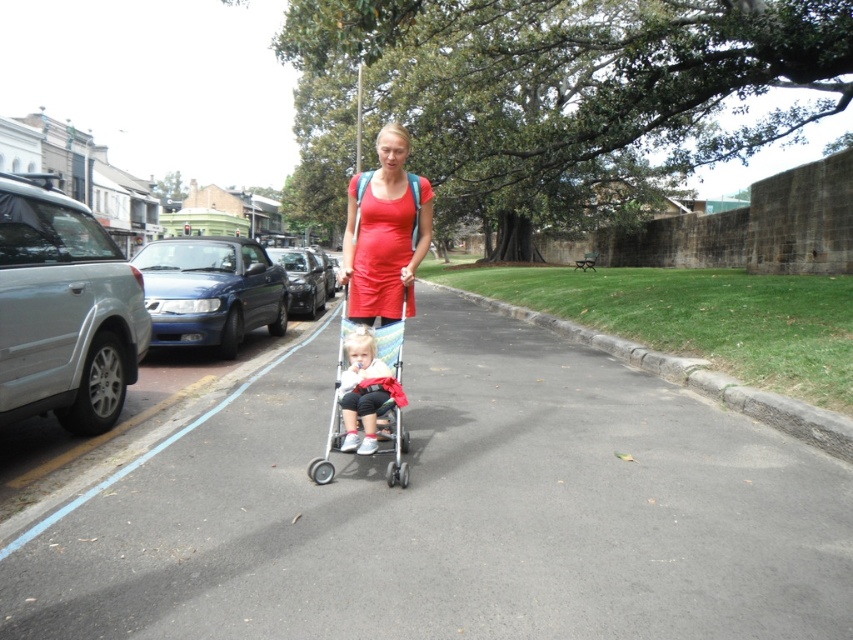
Question: Among these points, which one is nearest to the camera?

Choices:
 (A) (306, 291)
 (B) (177, 243)
 (C) (344, 236)

Answer: (C)

Question: Based on their relative distances, which object is nearer to the silver metallic car at left?

Choices:
 (A) shiny black car at center-left
 (B) matte red dress at center
 (C) matte pink fabric stroller at center

Answer: (C)

Question: Among these points, which one is farthest from the camera?

Choices:
 (A) (192, 296)
 (B) (67, 291)
 (C) (370, 365)

Answer: (A)

Question: Can you confirm if matte red dress at center is bigger than matte pink fabric stroller at center?

Choices:
 (A) no
 (B) yes

Answer: (A)

Question: Is matte red dress at center to the left of shiny black car at center-left from the viewer's perspective?

Choices:
 (A) no
 (B) yes

Answer: (A)

Question: Is silver metallic car at left wider than plastic baby carriage at center?

Choices:
 (A) yes
 (B) no

Answer: (B)